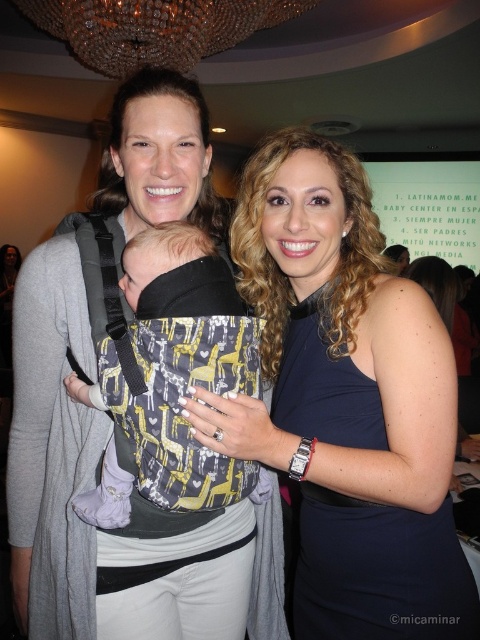
Question: Estimate the real-world distances between objects in this image. Which object is farther from the printed fabric baby carrier at center?

Choices:
 (A) matte black baby carrier at center
 (B) matte black dress at center

Answer: (B)

Question: Based on their relative distances, which object is farther from the matte black dress at center?

Choices:
 (A) matte black baby carrier at center
 (B) printed fabric baby carrier at center

Answer: (A)

Question: Among these points, which one is nearest to the camera?

Choices:
 (A) pos(226,387)
 (B) pos(180,310)

Answer: (B)

Question: Does matte black baby carrier at center appear on the left side of printed fabric baby carrier at center?

Choices:
 (A) yes
 (B) no

Answer: (A)

Question: In this image, where is matte black baby carrier at center located relative to printed fabric baby carrier at center?

Choices:
 (A) right
 (B) left

Answer: (B)

Question: Is matte black baby carrier at center behind printed fabric baby carrier at center?

Choices:
 (A) yes
 (B) no

Answer: (A)